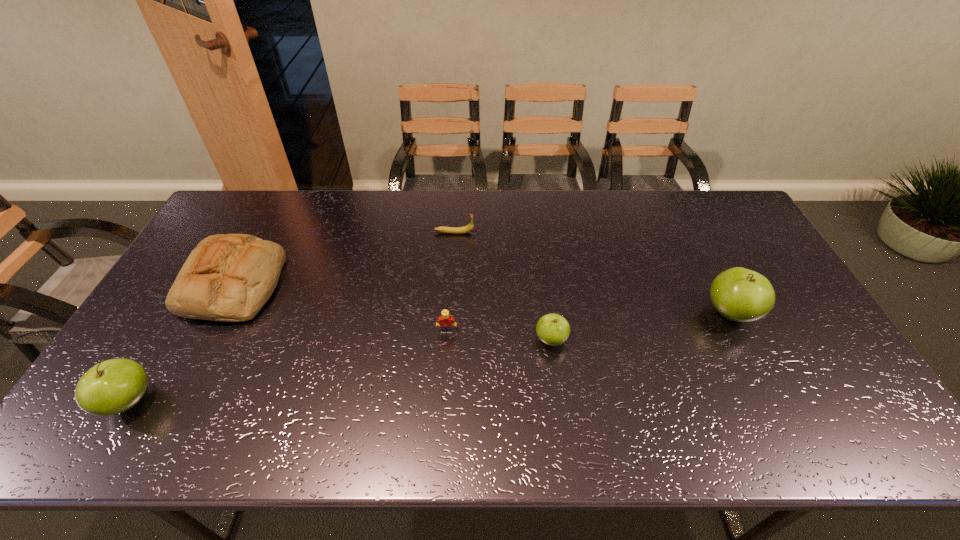
To make them evenly spaced by inserting another apple among them, please locate a free space for this new apple. Please provide its 2D coordinates. Your answer should be formatted as a tuple, i.e. [(x, y)], where the tuple contains the x and y coordinates of a point satisfying the conditions above.

[(351, 369)]